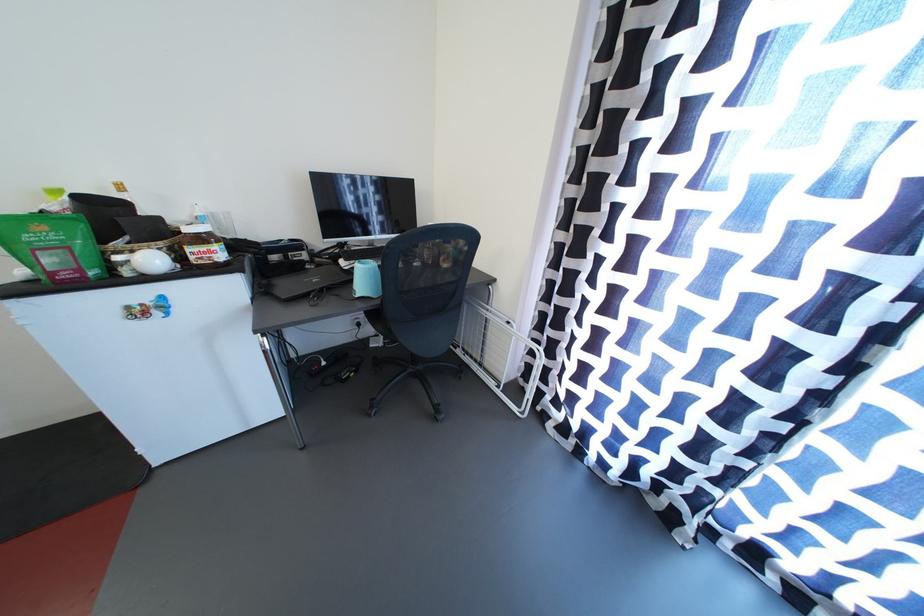
Describe the element at coordinates (55, 205) in the screenshot. This screenshot has width=924, height=616. I see `a yellow bottle cap` at that location.